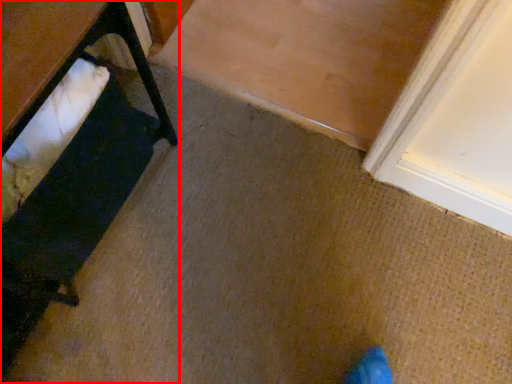
Question: In this image, where is furniture (annotated by the red box) located relative to table?

Choices:
 (A) right
 (B) left

Answer: (A)